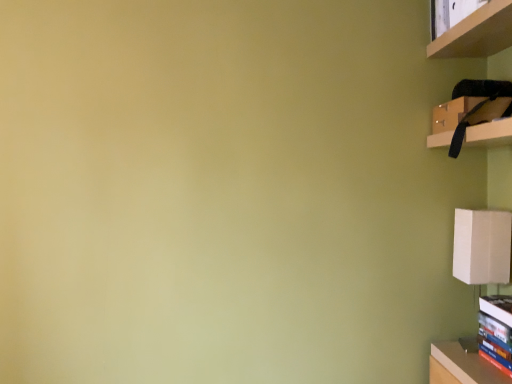
Question: Could you tell me if hardcover book at lower right is turned towards wooden shelf at upper right?

Choices:
 (A) no
 (B) yes

Answer: (A)

Question: Is hardcover book at lower right to the right of wooden shelf at upper right from the viewer's perspective?

Choices:
 (A) yes
 (B) no

Answer: (A)

Question: Can you confirm if hardcover book at lower right is bigger than wooden shelf at upper right?

Choices:
 (A) yes
 (B) no

Answer: (B)

Question: Does hardcover book at lower right appear on the left side of wooden shelf at upper right?

Choices:
 (A) yes
 (B) no

Answer: (B)

Question: Is wooden shelf at upper right inside hardcover book at lower right?

Choices:
 (A) no
 (B) yes

Answer: (A)

Question: Considering the positions of hardcover book at lower right and matte black cabinet at upper right in the image, is hardcover book at lower right bigger or smaller than matte black cabinet at upper right?

Choices:
 (A) big
 (B) small

Answer: (B)

Question: Considering the positions of hardcover book at lower right and matte black cabinet at upper right in the image, is hardcover book at lower right taller or shorter than matte black cabinet at upper right?

Choices:
 (A) short
 (B) tall

Answer: (B)

Question: From the image's perspective, is hardcover book at lower right above or below matte black cabinet at upper right?

Choices:
 (A) below
 (B) above

Answer: (A)

Question: Which is correct: hardcover book at lower right is inside matte black cabinet at upper right, or outside of it?

Choices:
 (A) outside
 (B) inside

Answer: (A)

Question: From their relative heights in the image, would you say wooden shelf at upper right is taller or shorter than matte black cabinet at upper right?

Choices:
 (A) tall
 (B) short

Answer: (B)

Question: From the image's perspective, is wooden shelf at upper right located above or below matte black cabinet at upper right?

Choices:
 (A) below
 (B) above

Answer: (B)

Question: Is point (455, 51) positioned closer to the camera than point (451, 130)?

Choices:
 (A) closer
 (B) farther

Answer: (B)

Question: Considering the positions of wooden shelf at upper right and matte black cabinet at upper right in the image, is wooden shelf at upper right wider or thinner than matte black cabinet at upper right?

Choices:
 (A) thin
 (B) wide

Answer: (A)

Question: Considering the positions of wooden shelf at upper right and hardcover book at lower right in the image, is wooden shelf at upper right taller or shorter than hardcover book at lower right?

Choices:
 (A) tall
 (B) short

Answer: (B)

Question: Considering their positions, is wooden shelf at upper right located in front of or behind hardcover book at lower right?

Choices:
 (A) front
 (B) behind

Answer: (A)